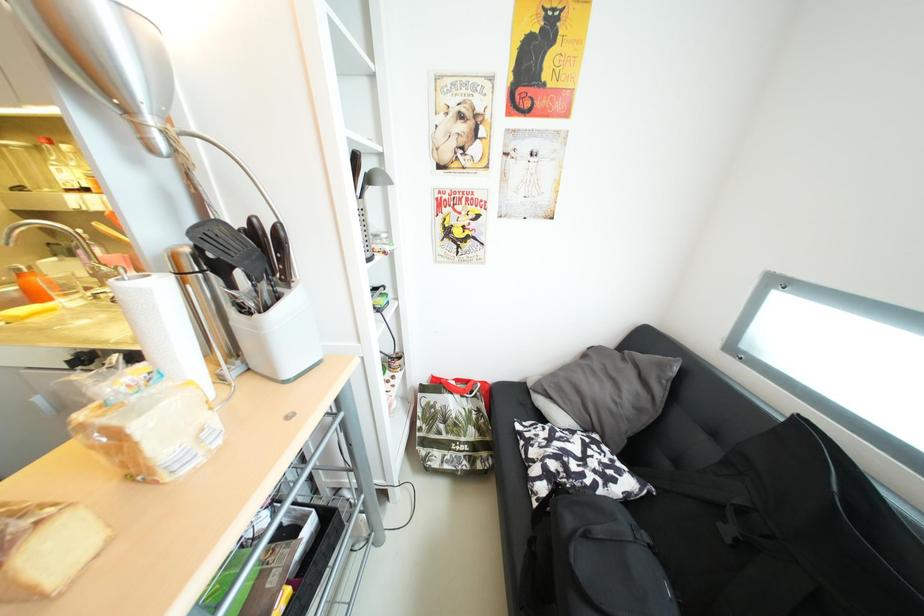
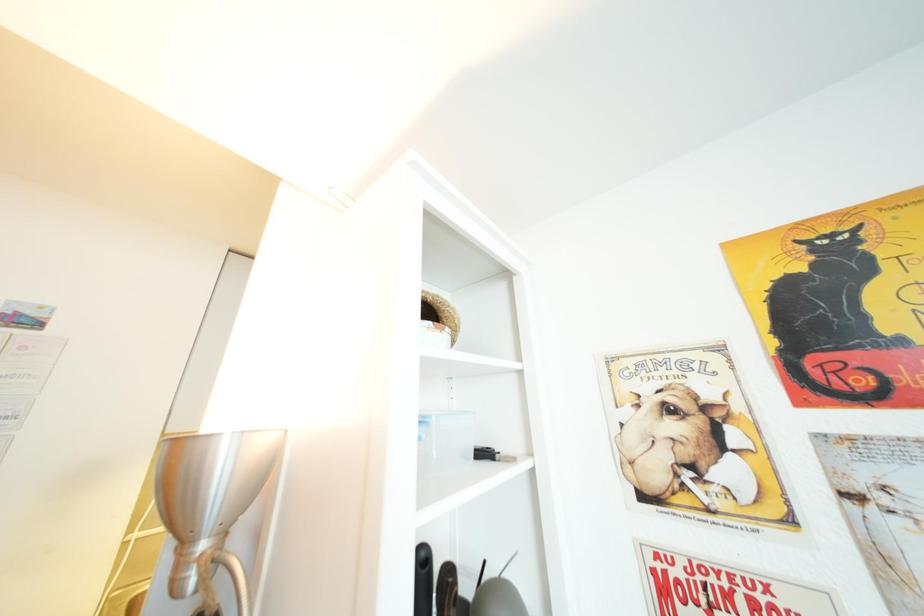
First-person continuous shooting, in which direction is the camera rotating?

The rotation direction of the camera is left-up.